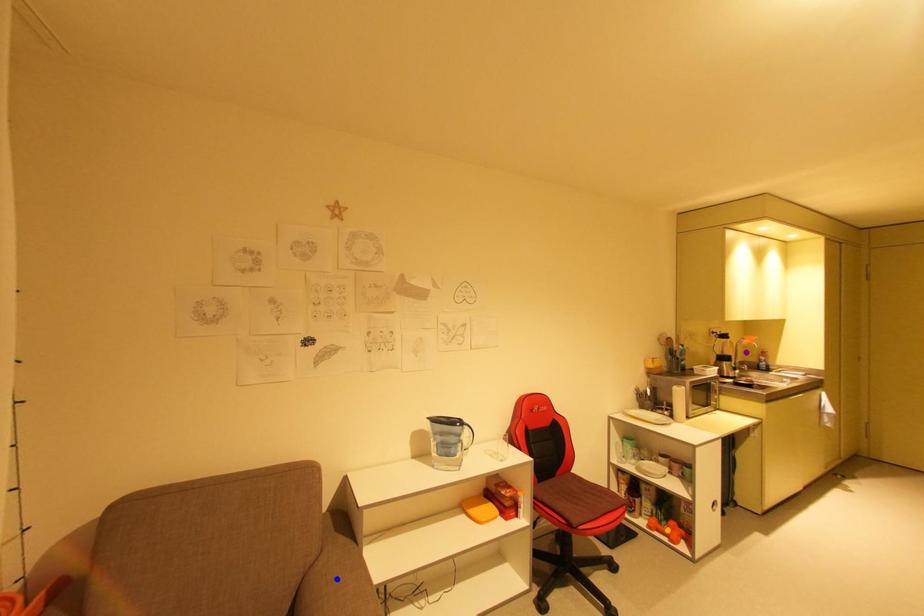
Order these from nearest to farthest:
1. blue point
2. purple point
3. orange point

blue point, orange point, purple point